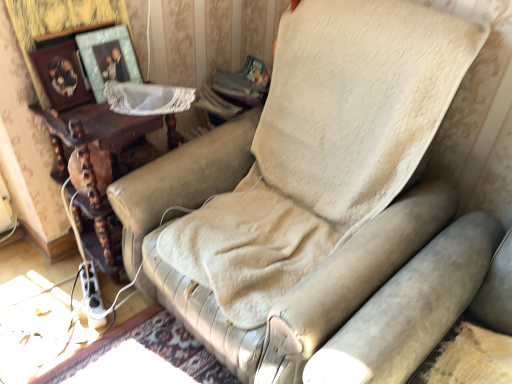
Question: Do you think wooden photo frame at upper left, which appears as the second picture frame when viewed from the right, is within brown wooden table at left, or outside of it?

Choices:
 (A) outside
 (B) inside

Answer: (A)

Question: From the image's perspective, is wooden photo frame at upper left, which is the first picture frame in left-to-right order, located above or below brown wooden table at left?

Choices:
 (A) below
 (B) above

Answer: (B)

Question: Which is nearer to the brown wooden table at left?

Choices:
 (A) metallic silver picture frame at upper left, which ranks as the 1th picture frame in right-to-left order
 (B) wooden photo frame at upper left, which appears as the second picture frame when viewed from the right

Answer: (B)

Question: Which is farther from the metallic silver picture frame at upper left, which appears as the second picture frame when viewed from the left?

Choices:
 (A) wooden photo frame at upper left, which is the first picture frame in left-to-right order
 (B) brown wooden table at left

Answer: (B)